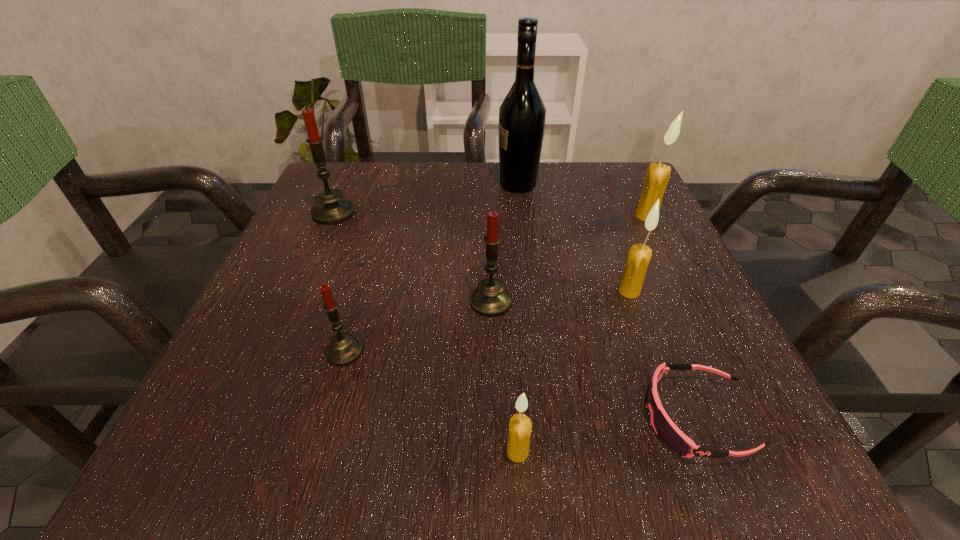
At what (x,y) coordinates should I click in order to perform the action: click on goggles that is positioned at the near edge. Please return your answer as a coordinate pair (x, y). The image size is (960, 540). Looking at the image, I should click on (669, 433).

You are a GUI agent. You are given a task and a screenshot of the screen. Output one action in this format:
    pyautogui.click(x=<x>, y=<y>)
    Task: Click on the goggles at the right edge
    This screenshot has width=960, height=540.
    Given the screenshot: What is the action you would take?
    point(669,433)

This screenshot has height=540, width=960. Identify the location of object at the far left corner. (331, 209).

Image resolution: width=960 pixels, height=540 pixels. In order to click on object present at the far right corner in this screenshot , I will do `click(655, 183)`.

The image size is (960, 540). I want to click on object that is at the near right corner, so click(x=669, y=433).

This screenshot has height=540, width=960. In the image, there is a desktop. In order to click on vacant space at the far edge in this screenshot , I will do `click(568, 191)`.

Locate an element on the screen. free space at the near edge of the desktop is located at coordinates (484, 476).

In the image, there is a desktop. Identify the location of free space at the left edge. This screenshot has height=540, width=960. (270, 366).

The width and height of the screenshot is (960, 540). In order to click on free space at the right edge of the desktop in this screenshot , I will do `click(704, 306)`.

Locate an element on the screen. Image resolution: width=960 pixels, height=540 pixels. free point at the far left corner is located at coordinates (360, 194).